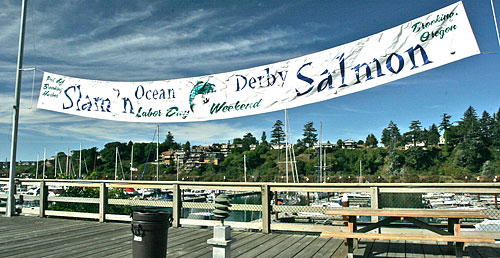
This screenshot has width=500, height=258. In order to click on trash can in this screenshot , I will do `click(148, 236)`.